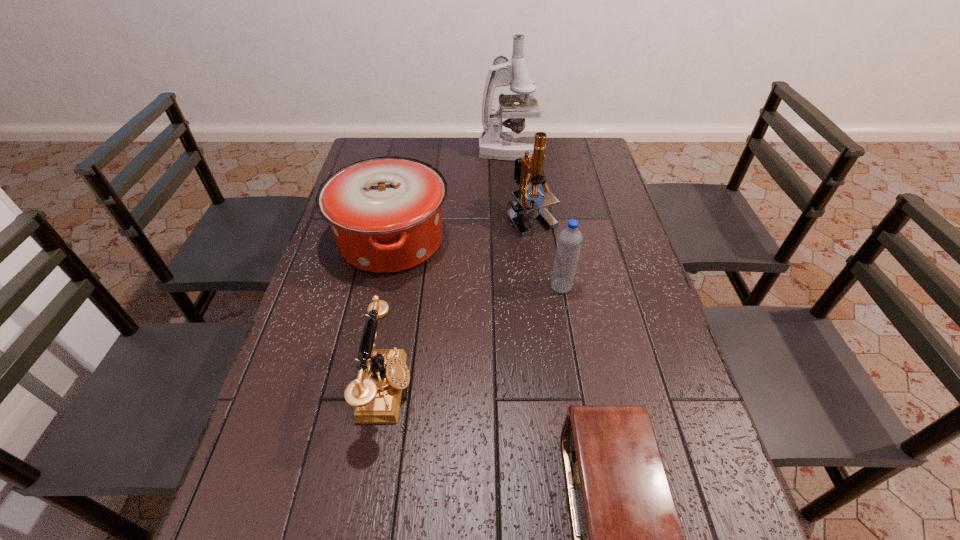
Locate an element on the screen. Image resolution: width=960 pixels, height=540 pixels. the farther microscope is located at coordinates (493, 143).

You are a GUI agent. You are given a task and a screenshot of the screen. Output one action in this format:
    pyautogui.click(x=<x>, y=<y>)
    Task: Click on the farthest object
    
    Given the screenshot: What is the action you would take?
    pyautogui.click(x=493, y=143)

Find the location of a particular element. This screenshot has width=960, height=540. the shorter microscope is located at coordinates (523, 204).

Find the location of a particular element. Image resolution: width=960 pixels, height=540 pixels. the second tallest object is located at coordinates (523, 204).

This screenshot has width=960, height=540. Identify the location of casserole. click(x=385, y=213).

This screenshot has width=960, height=540. I want to click on water bottle, so coord(569,243).

The height and width of the screenshot is (540, 960). I want to click on telephone, so click(376, 393).

The width and height of the screenshot is (960, 540). What are the coordinates of `vacant space located on the left of the tallest object` in the screenshot? It's located at (412, 151).

At what (x,y) coordinates should I click in order to perform the action: click on free space located at the eyepiece of the nearer microscope. Please return your answer as a coordinate pair (x, y). Image resolution: width=960 pixels, height=540 pixels. Looking at the image, I should click on (539, 272).

Locate an element on the screen. The image size is (960, 540). free spot located on the front of the casserole is located at coordinates (372, 334).